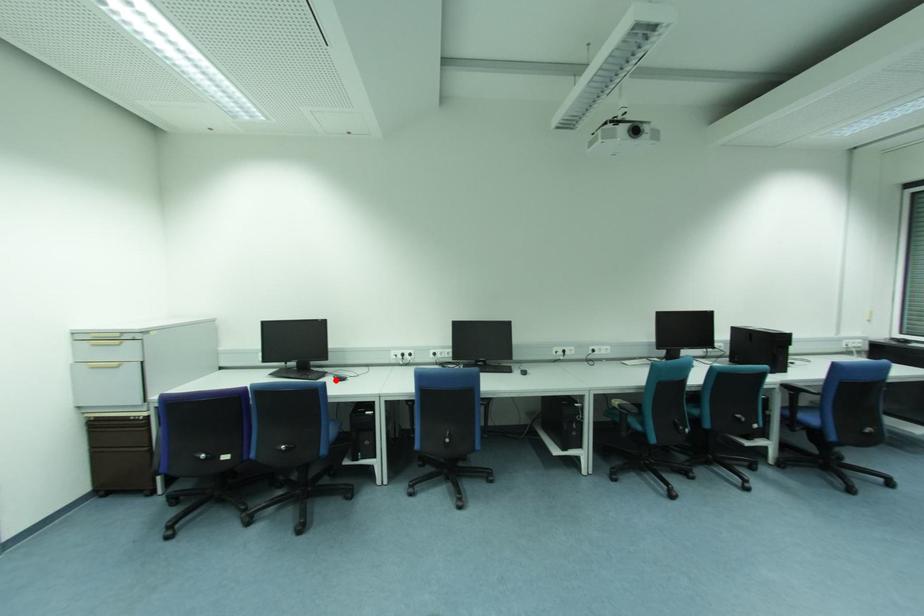
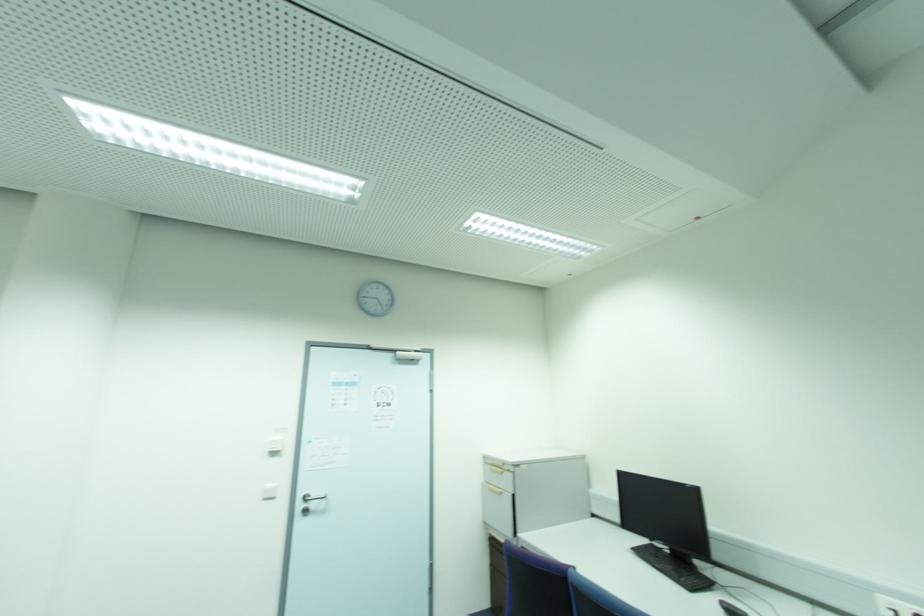
Where in the second image is the point corresponding to the highlighted location from the first image?

(723, 610)